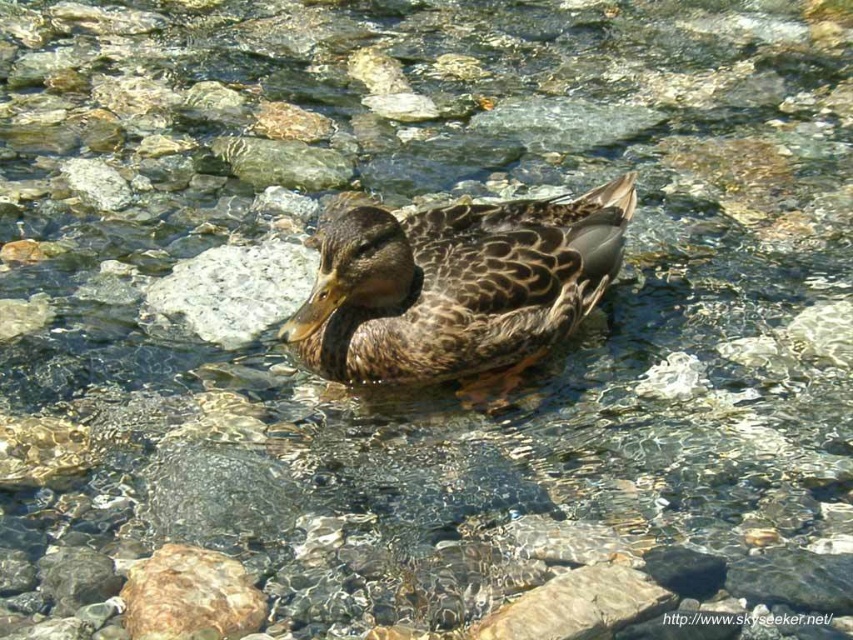
You are a photographer aiming to capture the duck in the scene. To ensure the gray smooth rock at center is perfectly centered in your photo, where should you position the camera relative to the rock?

The gray smooth rock at center is located at coordinates (234,289) in the scene. To center it in the photo, position the camera directly facing the rock at those coordinates.

Looking at this image, you are a birdwatcher trying to locate the duck in the image. According to the coordinates provided, where exactly is the brown speckled feathers at center located?

The brown speckled feathers at center are located at coordinates point [457,289].

You are standing 2 meters away from the camera. Can you see the point at coordinates point [544,321] in the image?

The point at coordinates point [544,321] is 2.30 meters away from the camera. Since you are only 2 meters away from the camera, you are closer to the camera than the point, so you can see the point at coordinates point [544,321] in the image.